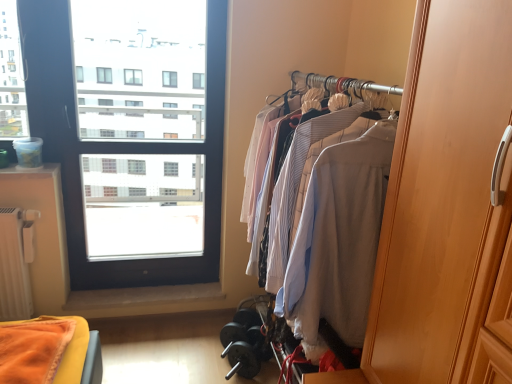
Question: Is wooden wardrobe at right thinner than light beige wood closet at right?

Choices:
 (A) yes
 (B) no

Answer: (A)

Question: Is wooden wardrobe at right taller than light beige wood closet at right?

Choices:
 (A) no
 (B) yes

Answer: (A)

Question: From the image's perspective, is wooden wardrobe at right above light beige wood closet at right?

Choices:
 (A) yes
 (B) no

Answer: (A)

Question: Could you tell me if wooden wardrobe at right is facing light beige wood closet at right?

Choices:
 (A) no
 (B) yes

Answer: (A)

Question: Can you confirm if wooden wardrobe at right is wider than light beige wood closet at right?

Choices:
 (A) yes
 (B) no

Answer: (B)

Question: Is wooden wardrobe at right smaller than light beige wood closet at right?

Choices:
 (A) yes
 (B) no

Answer: (A)

Question: From a real-world perspective, is transparent glass window at upper left over wooden wardrobe at right?

Choices:
 (A) yes
 (B) no

Answer: (B)

Question: Is transparent glass window at upper left taller than wooden wardrobe at right?

Choices:
 (A) yes
 (B) no

Answer: (A)

Question: Considering the relative sizes of transparent glass window at upper left and wooden wardrobe at right in the image provided, is transparent glass window at upper left shorter than wooden wardrobe at right?

Choices:
 (A) no
 (B) yes

Answer: (A)

Question: Is transparent glass window at upper left touching wooden wardrobe at right?

Choices:
 (A) no
 (B) yes

Answer: (A)

Question: Does transparent glass window at upper left lie in front of wooden wardrobe at right?

Choices:
 (A) yes
 (B) no

Answer: (B)

Question: Considering the relative sizes of transparent glass window at upper left and wooden wardrobe at right in the image provided, is transparent glass window at upper left bigger than wooden wardrobe at right?

Choices:
 (A) no
 (B) yes

Answer: (A)

Question: Would you say light beige wood closet at right is part of transparent glass window at upper left's contents?

Choices:
 (A) no
 (B) yes

Answer: (A)